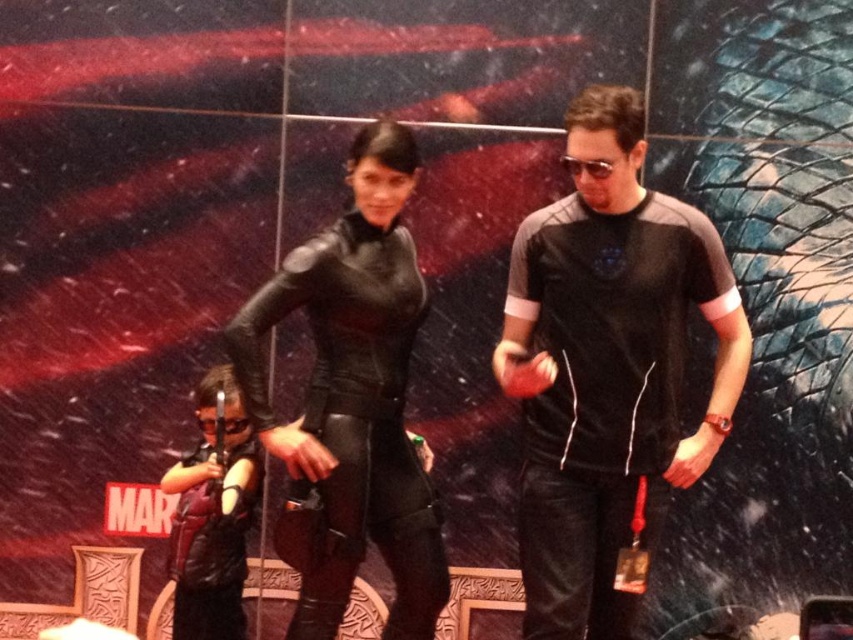
You are a costume designer observing the stage setup. You need to adjust the positions of the black leather suit at center and the black leather wetsuit at center so that the wetsuit is now on the right side. Which character should you move to the right?

The black leather wetsuit at center should be moved to the right so that it is positioned on the right side of the black leather suit at center.

You are directing a stage play and need to adjust the positioning of the two characters marked by points. The first point, point [654,401], is where the woman in the black outfit is standing. The second point, point [317,413], marks the position of the man. Based on their current positions, which character is closer to the audience if they are seated directly in front of the stage?

The woman in the black outfit at point [654,401] is closer to the audience because the point [654,401] is in front of point [317,413].

You are a photographer on the stage and need to arrange the black fabric shirt at center and the black leather wetsuit at center for a photo shoot. Which one should you move to the left to create space for a new model entering from the right?

The black fabric shirt at center is positioned on the right side of the black leather wetsuit at center. To create space for the new model entering from the right, you should move the black fabric shirt at center to the left, as it is currently to the right of the black leather wetsuit at center.